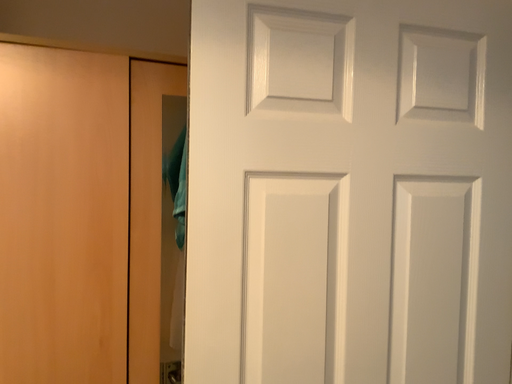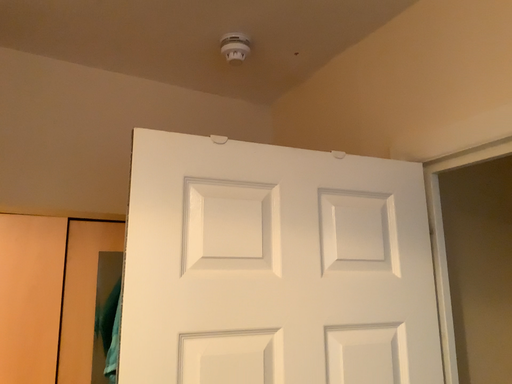
Question: How did the camera likely rotate when shooting the video?

Choices:
 (A) rotated upward
 (B) rotated downward

Answer: (A)